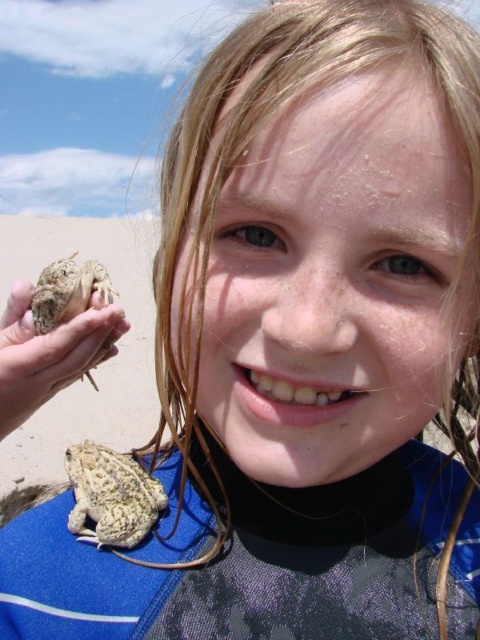
You are a photographer trying to capture the girl in the blue fabric wetsuit at center. To ensure the toad on her shoulder is also in focus, where should you position the camera relative to the girl?

The blue fabric wetsuit at center is located at point (250, 564), so you should position the camera directly facing the girl at the coordinates specified to ensure both the wetsuit and the toad on her shoulder are in focus.

You are a photographer trying to capture a closeup shot of the speckled brown frog at lower center. The camera you are using has a minimum focusing distance of 1 meter. Based on the scene description, can you successfully take a clear photo of the frog?

The distance between the speckled brown frog at lower center and the camera is 93.24 centimeters. Since the minimum focusing distance is 1 meter, the camera cannot focus closer than 100 cm. Therefore, the frog is too close for a clear photo.

You are a photographer trying to capture the speckled brown frog at lower center in the center of your photo. Given that your camera has a 100mm lens with a field of view of 12 degrees, and you are currently 2 meters away from the frog, will you need to move closer or farther away to center the frog in your photo?

The speckled brown frog at lower center is positioned at point coordinates of (110, 496). To center it in the photo, you would need to adjust your position based on the frog being off the center. Since the frog is at lower center, you might need to move slightly upwards or adjust the camera angle rather than distance. However, the question specifies moving closer or farther based on the field of view. With a 100mm lens at 2 meters, the field of view is 12 degrees. To center the frog, moving closer would 1